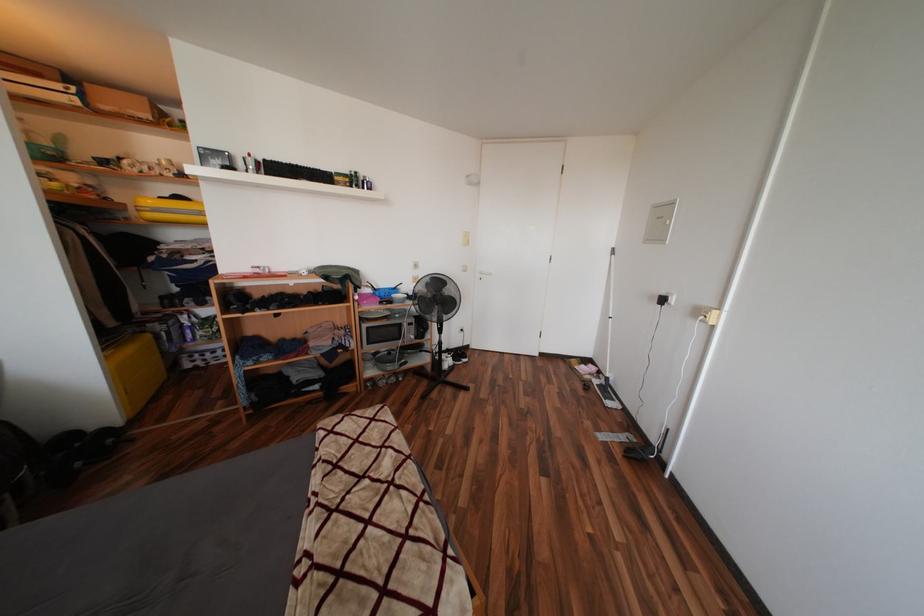
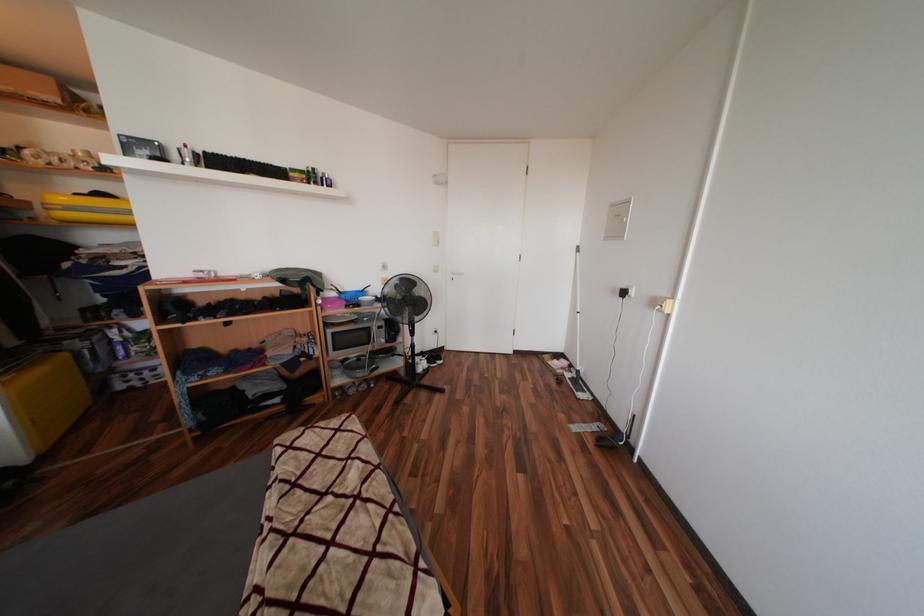
Question: The camera is either moving clockwise (left) or counter-clockwise (right) around the object. The first image is from the beginning of the video and the second image is from the end. Is the camera moving left or right when shooting the video?

Choices:
 (A) Left
 (B) Right

Answer: (A)